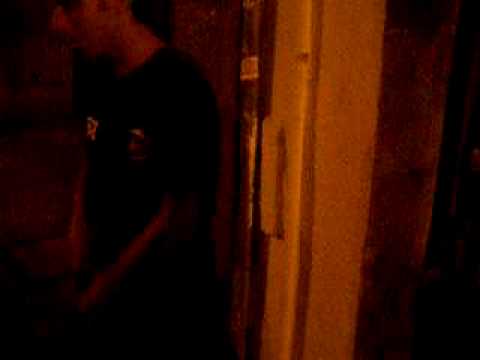
Where is `wood grain`? wood grain is located at coordinates (312, 266).